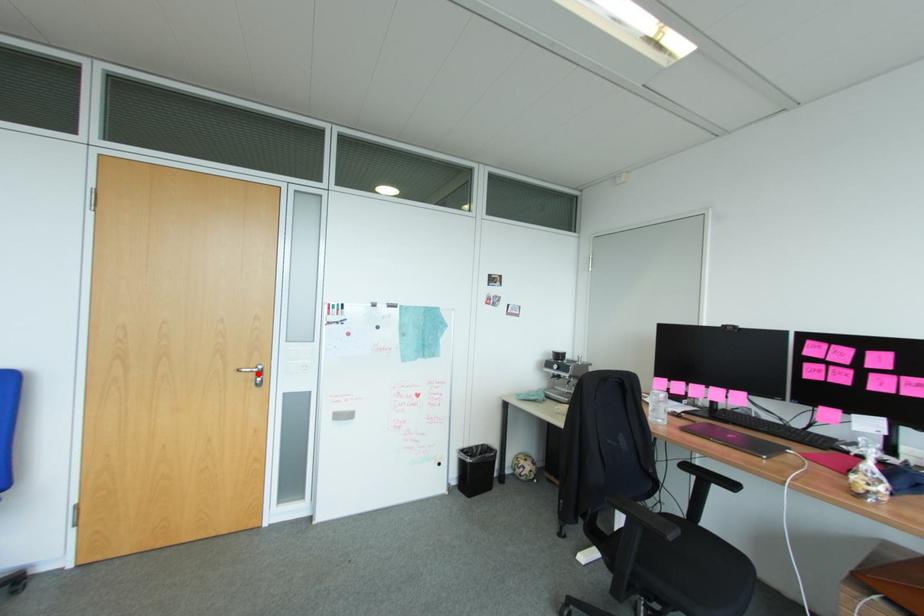
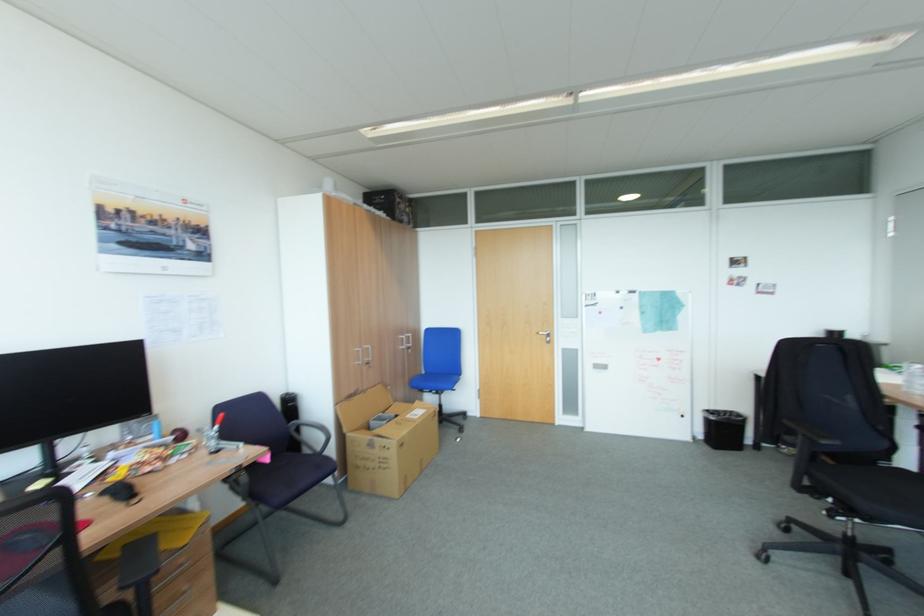
Where in the second image is the point corresponding to the highlighted location from the first image?

(551, 336)